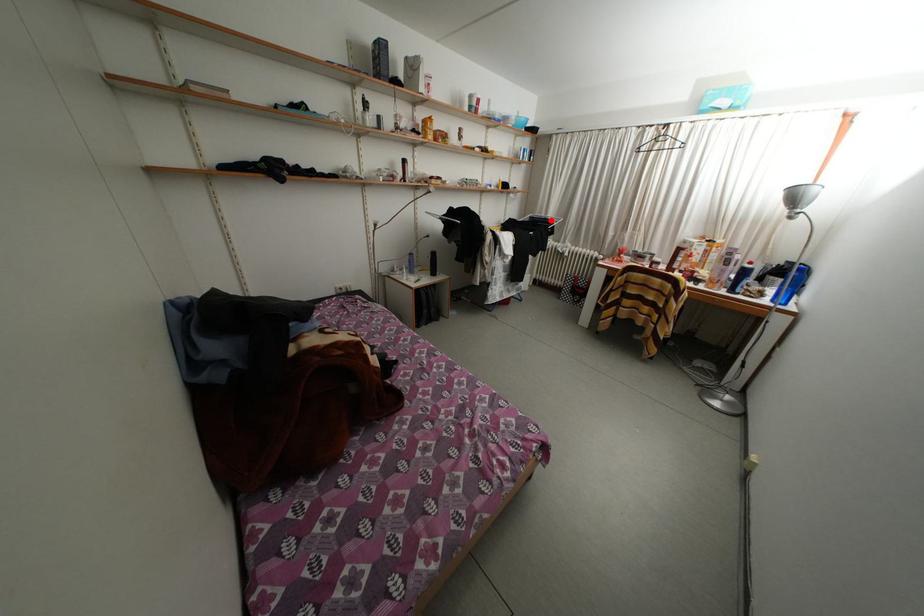
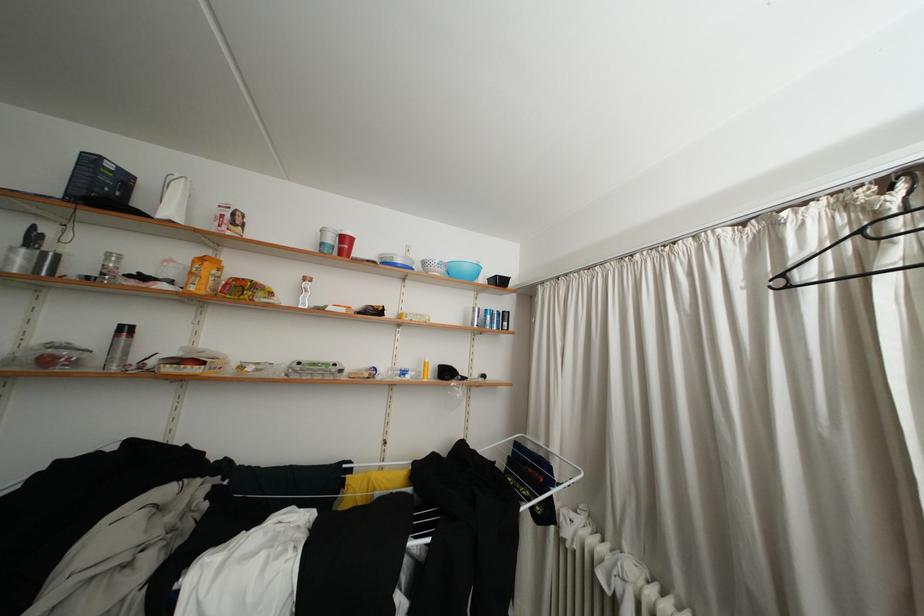
Question: I am providing you with two images of the same scene from different viewpoints. In image1, a red point is highlighted. Considering the same 3D point in image2, which of the following is correct?

Choices:
 (A) It is closer
 (B) It is farther

Answer: (B)